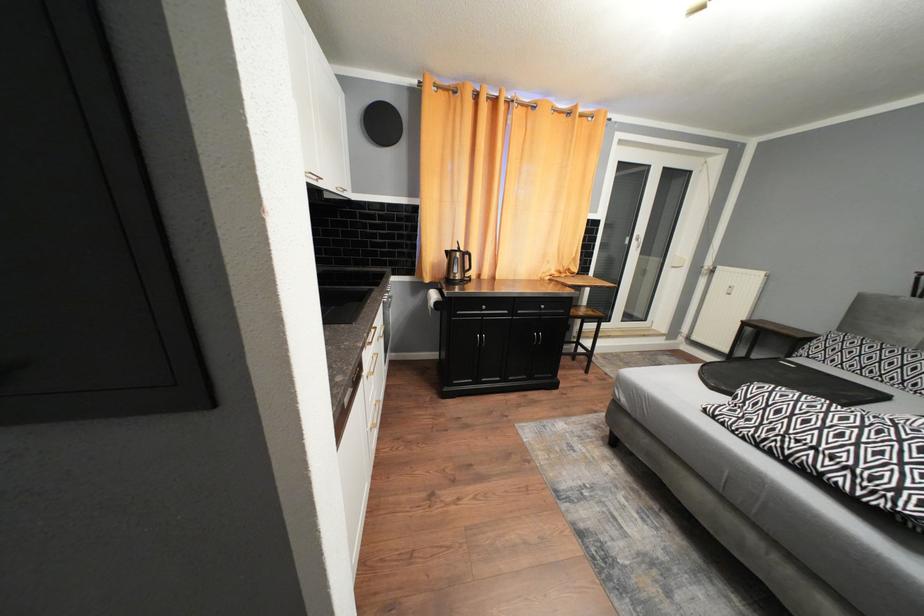
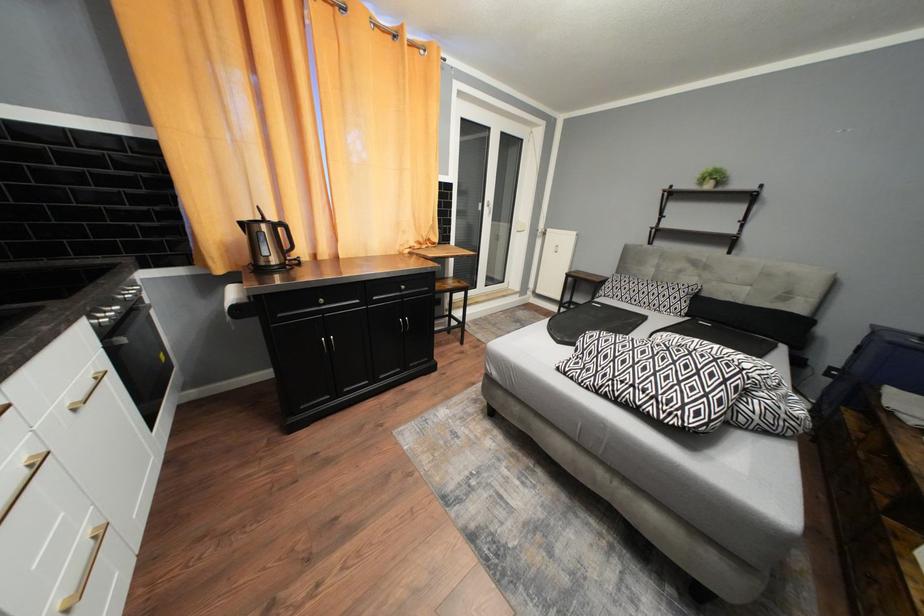
Which direction would the cameraman need to move to produce the second image?

The cameraman walked toward right, forward.